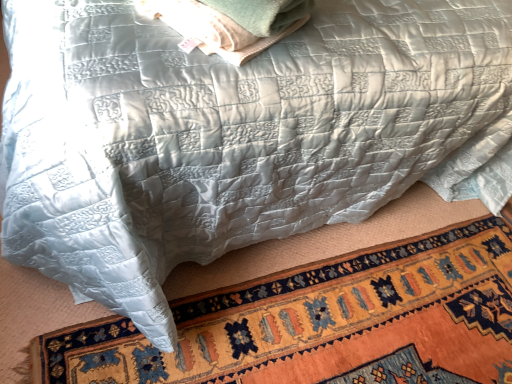
Find the location of a particular element. The width and height of the screenshot is (512, 384). free point above carpet with intricate patterns at lower center (from a real-world perspective) is located at coordinates (380, 318).